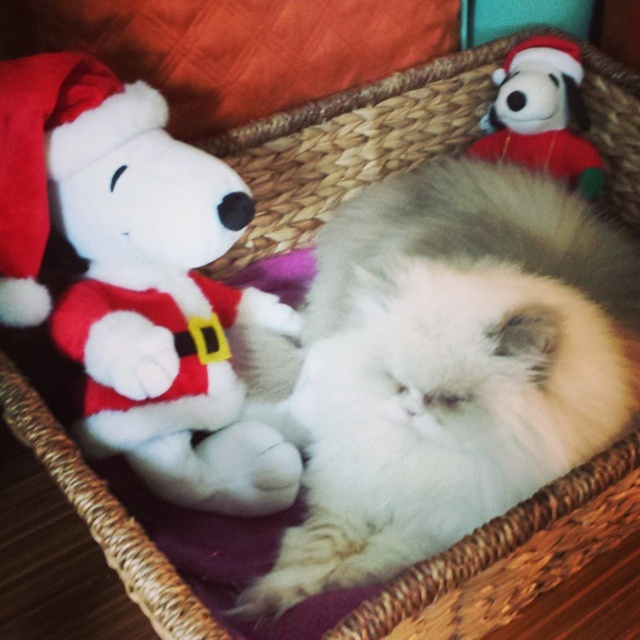
Question: Does white plush toy at left appear under white plush santa hat at upper right?

Choices:
 (A) no
 (B) yes

Answer: (B)

Question: Is white plush toy at left thinner than white plush santa hat at upper right?

Choices:
 (A) yes
 (B) no

Answer: (B)

Question: Is the position of white plush toy at left more distant than that of white plush santa hat at upper right?

Choices:
 (A) no
 (B) yes

Answer: (A)

Question: Among these points, which one is nearest to the camera?

Choices:
 (A) (532, 49)
 (B) (60, 72)

Answer: (B)

Question: Which object is closer to the camera taking this photo?

Choices:
 (A) white plush toy at left
 (B) white plush santa hat at upper right

Answer: (A)